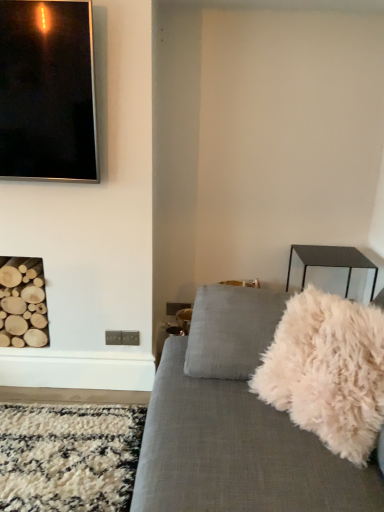
In order to click on black glossy picture frame at upper left in this screenshot , I will do `click(47, 91)`.

What do you see at coordinates (47, 91) in the screenshot? I see `black glossy picture frame at upper left` at bounding box center [47, 91].

What do you see at coordinates (328, 371) in the screenshot? I see `white fluffy throw pillow at right` at bounding box center [328, 371].

In order to click on white fluffy throw pillow at right in this screenshot , I will do `click(328, 371)`.

The image size is (384, 512). Identify the location of black glossy picture frame at upper left. (47, 91).

Would you say white fluffy throw pillow at right is to the left or to the right of black glossy picture frame at upper left in the picture?

white fluffy throw pillow at right is to the right of black glossy picture frame at upper left.

Relative to black glossy picture frame at upper left, is white fluffy throw pillow at right in front or behind?

Visually, white fluffy throw pillow at right is located in front of black glossy picture frame at upper left.

In the scene shown: Which is further, (x=375, y=441) or (x=9, y=129)?

The point (x=9, y=129) is farther.

From the image's perspective, does white fluffy throw pillow at right appear lower than black glossy picture frame at upper left?

Yes, from the image's perspective, white fluffy throw pillow at right is below black glossy picture frame at upper left.

Looking at this image, from a real-world perspective, is white fluffy throw pillow at right physically located above or below black glossy picture frame at upper left?

From a real-world perspective, white fluffy throw pillow at right is physically below black glossy picture frame at upper left.

Can you confirm if white fluffy throw pillow at right is thinner than black glossy picture frame at upper left?

Incorrect, the width of white fluffy throw pillow at right is not less than that of black glossy picture frame at upper left.

Considering the relative sizes of white fluffy throw pillow at right and black glossy picture frame at upper left in the image provided, is white fluffy throw pillow at right taller than black glossy picture frame at upper left?

In fact, white fluffy throw pillow at right may be shorter than black glossy picture frame at upper left.

Based on their sizes in the image, would you say white fluffy throw pillow at right is bigger or smaller than black glossy picture frame at upper left?

Considering their sizes, white fluffy throw pillow at right takes up more space than black glossy picture frame at upper left.

Is white fluffy throw pillow at right positioned beyond the bounds of black glossy picture frame at upper left?

Absolutely, white fluffy throw pillow at right is external to black glossy picture frame at upper left.

Is white fluffy throw pillow at right next to black glossy picture frame at upper left and touching it?

No, white fluffy throw pillow at right is not with black glossy picture frame at upper left.

Looking at this image, is white fluffy throw pillow at right turned away from black glossy picture frame at upper left?

white fluffy throw pillow at right is not turned away from black glossy picture frame at upper left.

Can you tell me how much white fluffy throw pillow at right and black glossy picture frame at upper left differ in facing direction?

There is a 51.3-degree angle between the facing directions of white fluffy throw pillow at right and black glossy picture frame at upper left.

How much distance is there between white fluffy throw pillow at right and black glossy picture frame at upper left?

4.15 feet.

Find the location of a particular element. This screenshot has height=512, width=384. picture frame on the left of white fluffy throw pillow at right is located at coordinates (47, 91).

Which object is positioned more to the left, black glossy picture frame at upper left or white fluffy throw pillow at right?

black glossy picture frame at upper left is more to the left.

Which is behind, black glossy picture frame at upper left or white fluffy throw pillow at right?

black glossy picture frame at upper left.

Considering the positions of points (52, 79) and (305, 392), is point (52, 79) closer to camera compared to point (305, 392)?

No, it is not.

From the image's perspective, is black glossy picture frame at upper left under white fluffy throw pillow at right?

Incorrect, from the image's perspective, black glossy picture frame at upper left is higher than white fluffy throw pillow at right.

From a real-world perspective, between black glossy picture frame at upper left and white fluffy throw pillow at right, who is vertically higher?

black glossy picture frame at upper left.

Between black glossy picture frame at upper left and white fluffy throw pillow at right, which one has smaller width?

black glossy picture frame at upper left.

Is black glossy picture frame at upper left shorter than white fluffy throw pillow at right?

Incorrect, the height of black glossy picture frame at upper left does not fall short of that of white fluffy throw pillow at right.

Which of these two, black glossy picture frame at upper left or white fluffy throw pillow at right, is smaller?

With smaller size is black glossy picture frame at upper left.

Is black glossy picture frame at upper left completely or partially outside of white fluffy throw pillow at right?

Yes, black glossy picture frame at upper left is outside of white fluffy throw pillow at right.

Is black glossy picture frame at upper left touching white fluffy throw pillow at right?

No, black glossy picture frame at upper left is not in contact with white fluffy throw pillow at right.

Could you tell me if black glossy picture frame at upper left is turned towards white fluffy throw pillow at right?

No, black glossy picture frame at upper left does not turn towards white fluffy throw pillow at right.

Where is `throw pillow below the black glossy picture frame at upper left (from a real-world perspective)`? The image size is (384, 512). throw pillow below the black glossy picture frame at upper left (from a real-world perspective) is located at coordinates (328, 371).

In the image, there is a black glossy picture frame at upper left. Where is `throw pillow below it (from the image's perspective)`? This screenshot has width=384, height=512. throw pillow below it (from the image's perspective) is located at coordinates (328, 371).

Identify the location of throw pillow lying on the right of black glossy picture frame at upper left. The height and width of the screenshot is (512, 384). (328, 371).